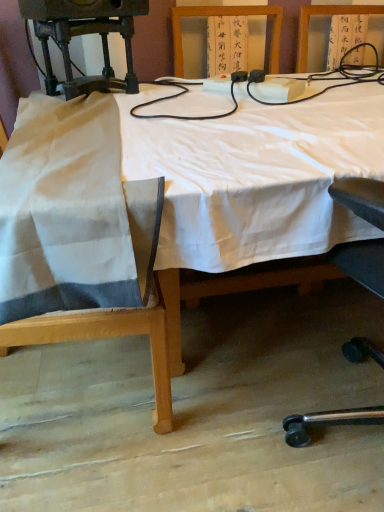
Question: Is white fabric chair at left in contact with white cloth-covered table at center?

Choices:
 (A) no
 (B) yes

Answer: (A)

Question: Is white fabric chair at left at the left side of white cloth-covered table at center?

Choices:
 (A) yes
 (B) no

Answer: (A)

Question: Considering the relative sizes of white fabric chair at left and white cloth-covered table at center in the image provided, is white fabric chair at left smaller than white cloth-covered table at center?

Choices:
 (A) no
 (B) yes

Answer: (B)

Question: Is white fabric chair at left facing away from white cloth-covered table at center?

Choices:
 (A) no
 (B) yes

Answer: (B)

Question: Is white fabric chair at left facing towards white cloth-covered table at center?

Choices:
 (A) no
 (B) yes

Answer: (B)

Question: Can you confirm if white fabric chair at left is shorter than white cloth-covered table at center?

Choices:
 (A) no
 (B) yes

Answer: (A)

Question: Is white cloth-covered table at center shorter than white fabric chair at left?

Choices:
 (A) yes
 (B) no

Answer: (A)

Question: Is white cloth-covered table at center wider than white fabric chair at left?

Choices:
 (A) yes
 (B) no

Answer: (A)

Question: Is white cloth-covered table at center not inside white fabric chair at left?

Choices:
 (A) no
 (B) yes

Answer: (B)

Question: Does white cloth-covered table at center lie in front of white fabric chair at left?

Choices:
 (A) yes
 (B) no

Answer: (A)

Question: Is white cloth-covered table at center at the left side of white fabric chair at left?

Choices:
 (A) yes
 (B) no

Answer: (B)

Question: Can you confirm if white cloth-covered table at center is taller than white fabric chair at left?

Choices:
 (A) yes
 (B) no

Answer: (B)

Question: Is white fabric chair at left inside the boundaries of white cloth-covered table at center, or outside?

Choices:
 (A) outside
 (B) inside

Answer: (B)